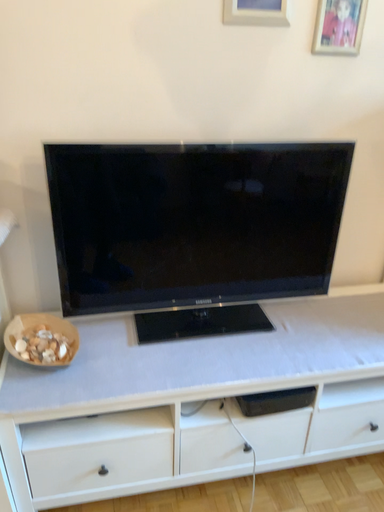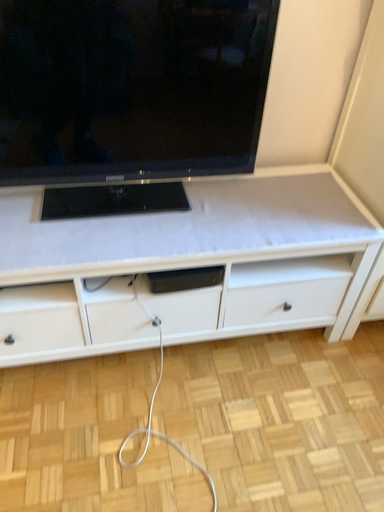
Question: How did the camera likely rotate when shooting the video?

Choices:
 (A) rotated upward
 (B) rotated downward

Answer: (B)